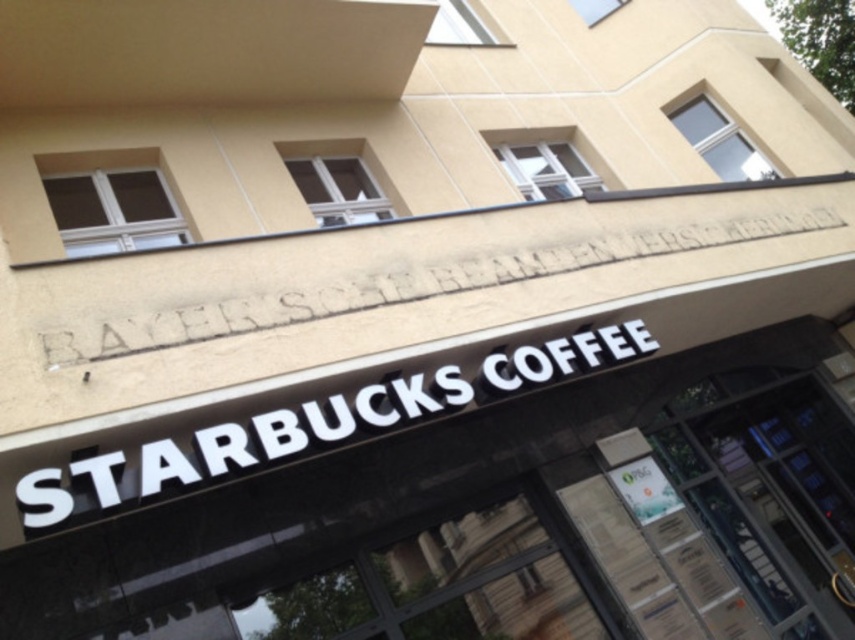
Question: Can you confirm if white plastic sign at center is thinner than white stone engraving at center?

Choices:
 (A) yes
 (B) no

Answer: (B)

Question: Does transparent glass door at center appear under white plastic sign at center?

Choices:
 (A) no
 (B) yes

Answer: (B)

Question: Which point is farther to the camera?

Choices:
 (A) (102, 339)
 (B) (51, 488)
 (C) (808, 484)

Answer: (C)

Question: Which object is positioned farthest from the white stone engraving at center?

Choices:
 (A) transparent glass door at center
 (B) white plastic sign at center

Answer: (A)

Question: Which point is farther from the camera taking this photo?

Choices:
 (A) (776, 387)
 (B) (342, 442)

Answer: (A)

Question: Does white plastic sign at center appear on the right side of white stone engraving at center?

Choices:
 (A) yes
 (B) no

Answer: (B)